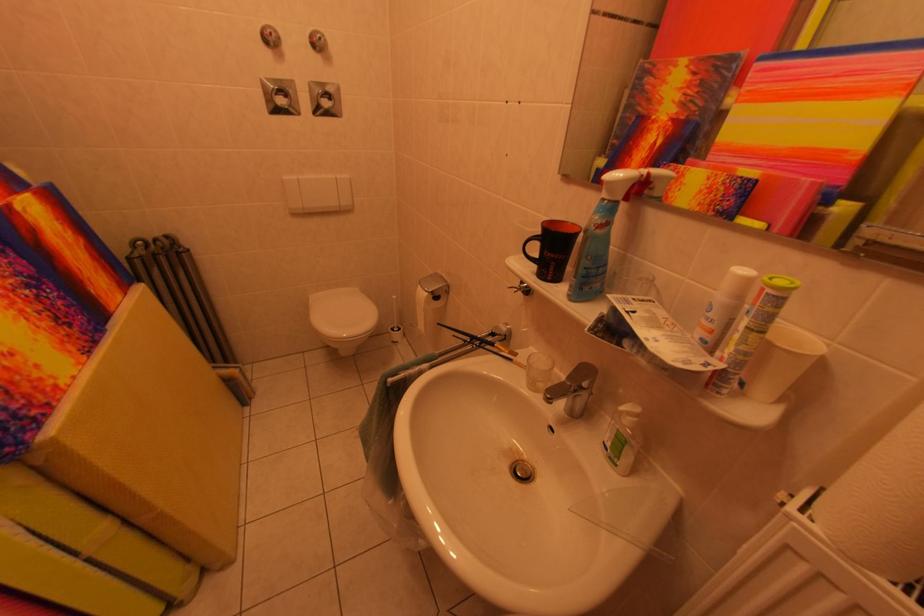
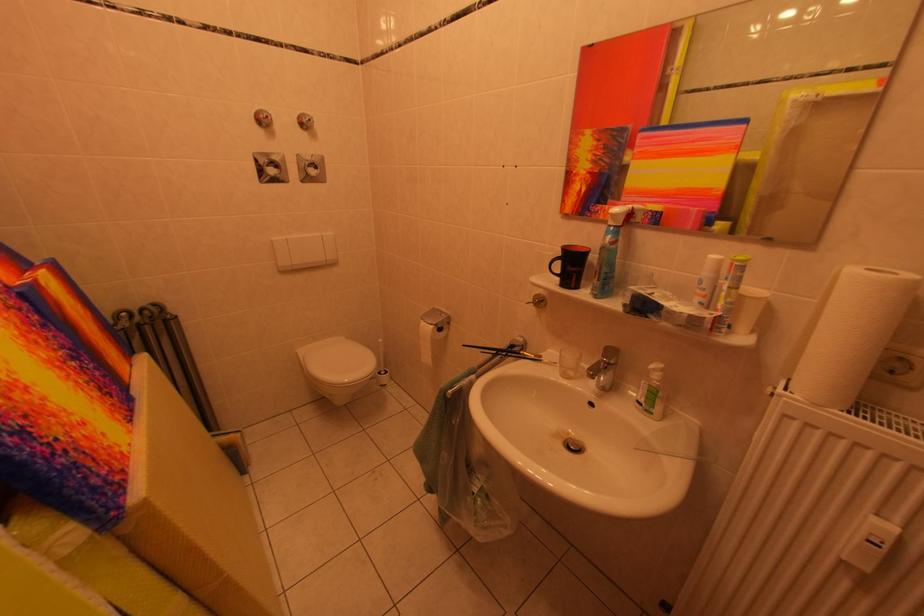
Locate, in the second image, the point that corresponds to [502,338] in the first image.

(520, 351)